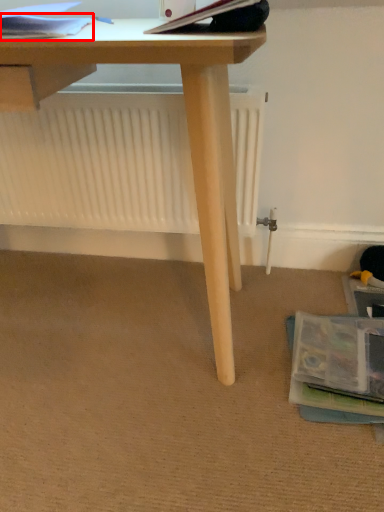
Question: From the image's perspective, where is paperback book (annotated by the red box) located relative to paperback book?

Choices:
 (A) below
 (B) above

Answer: (B)